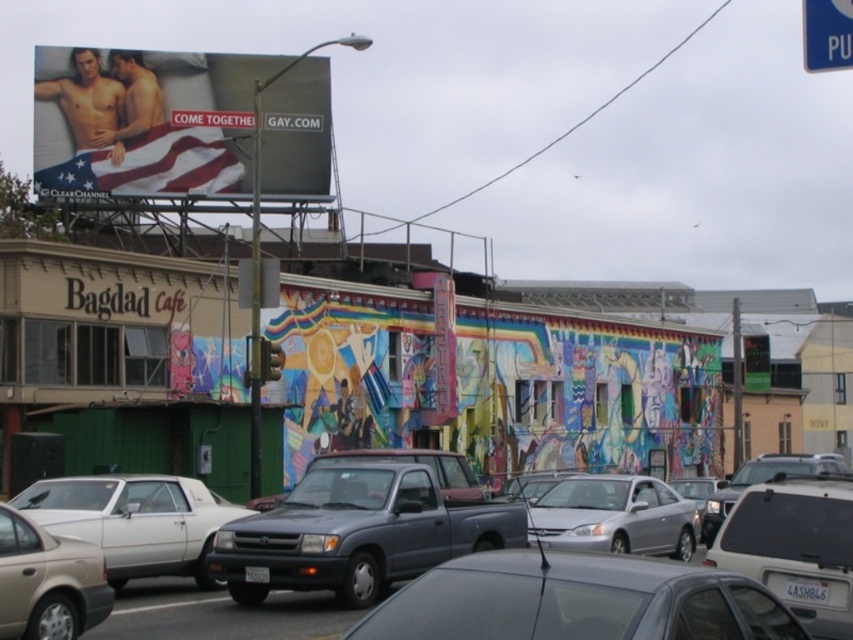
Question: Estimate the real-world distances between objects in this image. Which object is closer to the silver metallic sedan at center?

Choices:
 (A) metallic gray sedan at center
 (B) silver metallic sedan at lower left

Answer: (B)

Question: Can you confirm if white glossy sedan at lower left is thinner than silver metallic sedan at center?

Choices:
 (A) yes
 (B) no

Answer: (B)

Question: Which is farther from the metallic gray sedan at center?

Choices:
 (A) silver metallic truck at center
 (B) american flag fabric bed at upper left
 (C) silver metallic sedan at center
 (D) white plastic sign at upper right

Answer: (B)

Question: Can you confirm if american flag fabric bed at upper left is positioned to the right of metallic gray sedan at center?

Choices:
 (A) yes
 (B) no

Answer: (B)

Question: Considering the real-world distances, which object is closest to the metallic gray sedan at center?

Choices:
 (A) white plastic sign at upper right
 (B) american flag fabric bed at upper left
 (C) matte gray truck at center
 (D) silver metallic sedan at lower left

Answer: (D)

Question: Can you confirm if metallic gray sedan at center is positioned above matte gray truck at center?

Choices:
 (A) no
 (B) yes

Answer: (B)